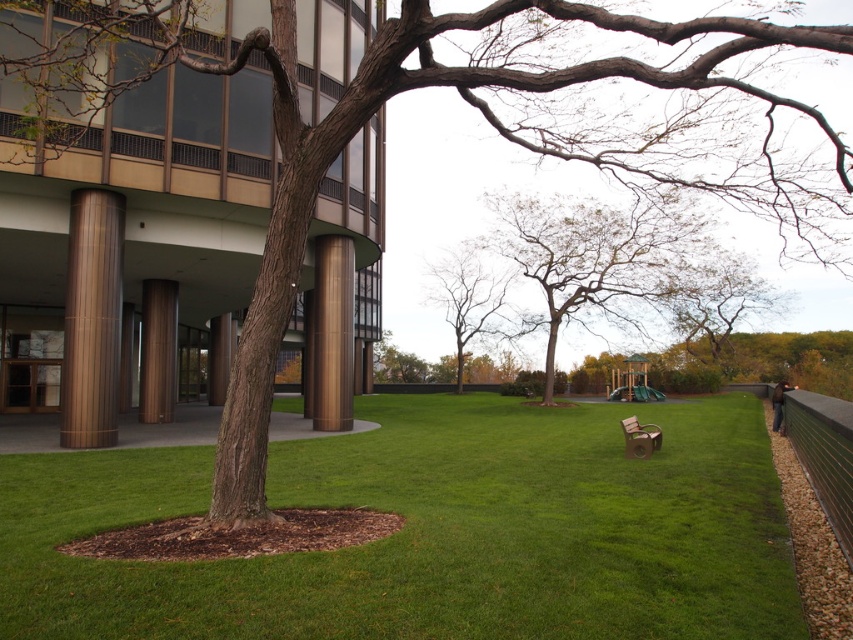
Question: Does brown textured tree at center lie in front of brown polished column at left?

Choices:
 (A) no
 (B) yes

Answer: (B)

Question: Which object appears closest to the camera in this image?

Choices:
 (A) bronze polished pillar at center
 (B) green textured fence at right

Answer: (B)

Question: Estimate the real-world distances between objects in this image. Which object is closer to the bronze polished pillar at center?

Choices:
 (A) bare branches at center
 (B) brown textured column at center
 (C) green grass at center
 (D) brown textured tree at center

Answer: (C)

Question: Which of the following is the closest to the observer?

Choices:
 (A) (318, 413)
 (B) (225, 384)
 (C) (546, 554)
 (D) (720, 312)

Answer: (C)

Question: Does brown textured tree at center appear on the left side of brown textured column at center?

Choices:
 (A) yes
 (B) no

Answer: (B)

Question: Is brown textured tree at upper right to the right of bronze polished pillar at center from the viewer's perspective?

Choices:
 (A) no
 (B) yes

Answer: (B)